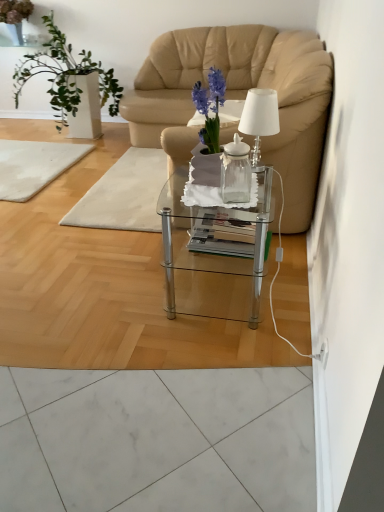
This screenshot has width=384, height=512. In order to click on vacant space to the left of clear glass coffee table at center in this screenshot , I will do `click(121, 291)`.